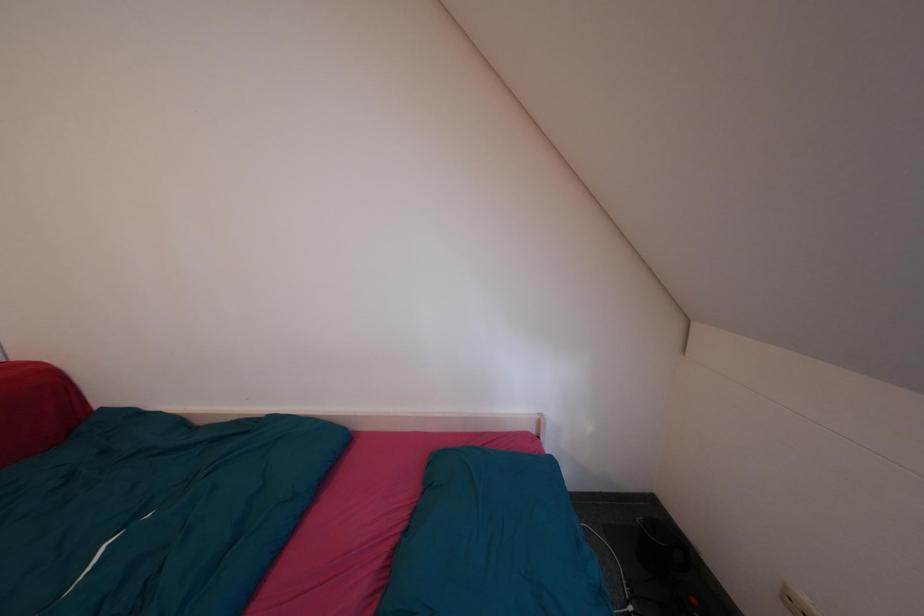
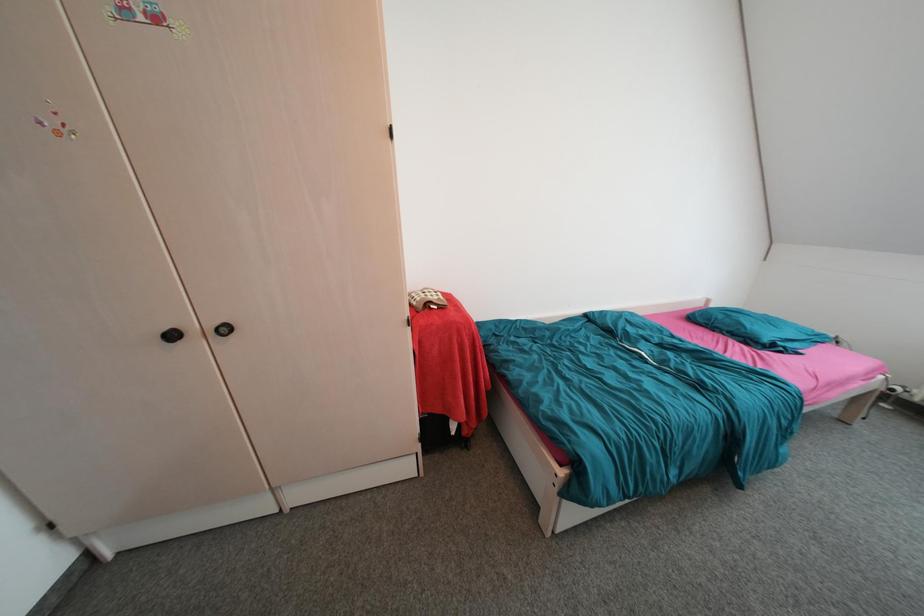
Question: What movement of the cameraman would produce the second image?

Choices:
 (A) Left
 (B) Right
 (C) Forward
 (D) Backward

Answer: (A)